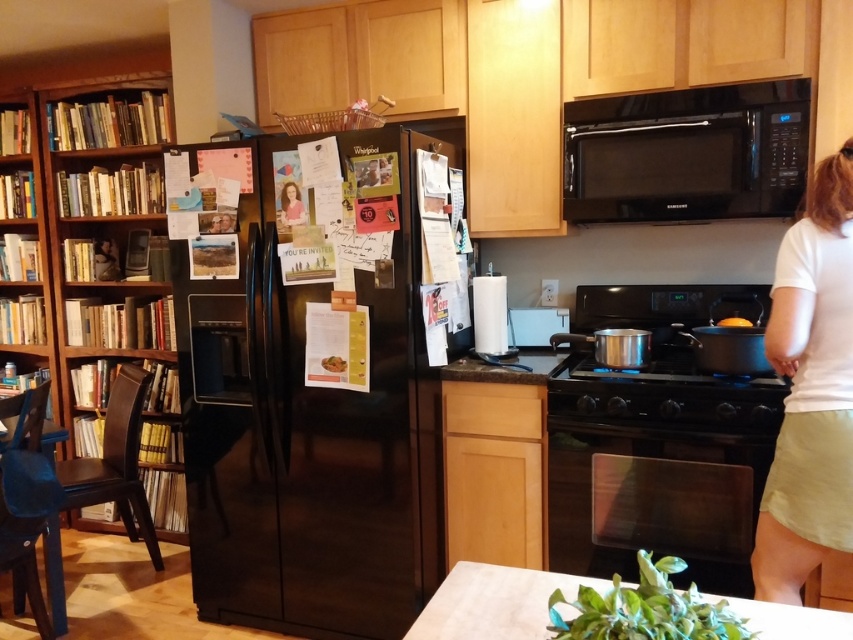
Question: Which of the following is the farthest from the observer?

Choices:
 (A) (97, 99)
 (B) (463, 564)

Answer: (A)

Question: Is the position of black matte refrigerator at center less distant than that of black glass oven at lower center?

Choices:
 (A) yes
 (B) no

Answer: (B)

Question: Is black glossy microwave at upper center to the right of white matte countertop at lower center from the viewer's perspective?

Choices:
 (A) yes
 (B) no

Answer: (A)

Question: Which point appears farthest from the camera in this image?

Choices:
 (A) (688, 550)
 (B) (773, 632)
 (C) (828, 458)
 (D) (180, 360)

Answer: (D)

Question: Which of these objects is positioned closest to the wooden bookshelf at left?

Choices:
 (A) black matte refrigerator at center
 (B) white cotton shirt at right
 (C) black glass oven at lower center

Answer: (A)

Question: Does black glossy microwave at upper center appear on the right side of black glass oven at lower center?

Choices:
 (A) no
 (B) yes

Answer: (B)